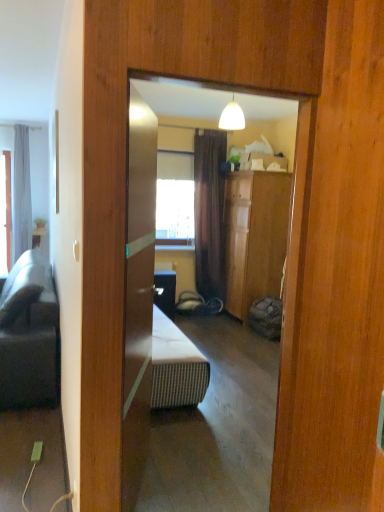
Describe the element at coordinates (21, 193) in the screenshot. I see `gray fabric curtain at left` at that location.

The image size is (384, 512). I want to click on dark gray fabric studio couch at left, so click(x=31, y=346).

How many degrees apart are the facing directions of gray fabric curtain at left and dark gray fabric studio couch at left?

88.5 degrees separate the facing orientations of gray fabric curtain at left and dark gray fabric studio couch at left.

From a real-world perspective, who is located higher, gray fabric curtain at left or dark gray fabric studio couch at left?

gray fabric curtain at left, from a real-world perspective.

Considering the sizes of gray fabric curtain at left and dark gray fabric studio couch at left in the image, is gray fabric curtain at left taller or shorter than dark gray fabric studio couch at left?

In the image, gray fabric curtain at left appears to be taller than dark gray fabric studio couch at left.

Is the position of gray fabric curtain at left more distant than that of dark gray fabric studio couch at left?

That is True.

From the image's perspective, which object appears higher, dark gray fabric studio couch at left or gray fabric curtain at left?

gray fabric curtain at left is shown above in the image.

Can you confirm if dark gray fabric studio couch at left is taller than gray fabric curtain at left?

Incorrect, the height of dark gray fabric studio couch at left is not larger of that of gray fabric curtain at left.

You are a GUI agent. You are given a task and a screenshot of the screen. Output one action in this format:
    pyautogui.click(x=<x>, y=<y>)
    Task: Click on the studio couch that is under the gray fabric curtain at left (from a real-world perspective)
    Image resolution: width=384 pixels, height=512 pixels.
    Given the screenshot: What is the action you would take?
    pyautogui.click(x=31, y=346)

Which object is positioned more to the left, dark gray fabric studio couch at left or gray fabric curtain at left?

gray fabric curtain at left.

Is there a large distance between gray fabric curtain at left and matte white table at left?

No.

Which object is wider, gray fabric curtain at left or matte white table at left?

gray fabric curtain at left.

From the image's perspective, would you say gray fabric curtain at left is shown under matte white table at left?

No, from the image's perspective, gray fabric curtain at left is not beneath matte white table at left.

Which is behind, gray fabric curtain at left or matte white table at left?

matte white table at left is further away from the camera.

Can we say dark gray fabric studio couch at left lies outside matte white table at left?

Indeed, dark gray fabric studio couch at left is completely outside matte white table at left.

Considering the relative positions of dark gray fabric studio couch at left and matte white table at left in the image provided, is dark gray fabric studio couch at left to the left of matte white table at left from the viewer's perspective?

No, dark gray fabric studio couch at left is not to the left of matte white table at left.

Is point (6, 389) closer or farther from the camera than point (43, 227)?

Point (6, 389) is closer to the camera than point (43, 227).

Is the depth of matte white table at left greater than that of dark gray fabric studio couch at left?

Answer: Yes, matte white table at left is further from the camera.

This screenshot has width=384, height=512. Identify the location of table above the dark gray fabric studio couch at left (from the image's perspective). (38, 236).

From the image's perspective, is matte white table at left on dark gray fabric studio couch at left?

Yes, from the image's perspective, matte white table at left is on top of dark gray fabric studio couch at left.

Based on their sizes in the image, would you say matte white table at left is bigger or smaller than dark gray fabric studio couch at left?

Considering their sizes, matte white table at left takes up less space than dark gray fabric studio couch at left.

Which is closer to the camera, (40, 244) or (19, 130)?

Point (40, 244) is positioned closer to the camera compared to point (19, 130).

Which object is more forward, matte white table at left or gray fabric curtain at left?

gray fabric curtain at left is closer to the camera.

Locate an element on the screen. table below the gray fabric curtain at left (from the image's perspective) is located at coordinates (38, 236).

What's the angular difference between matte white table at left and gray fabric curtain at left's facing directions?

They differ by 0.000341 degrees in their facing directions.

This screenshot has width=384, height=512. Identify the location of curtain located above the dark gray fabric studio couch at left (from the image's perspective). (21, 193).

At what (x,y) coordinates should I click in order to perform the action: click on curtain above the dark gray fabric studio couch at left (from a real-world perspective). Please return your answer as a coordinate pair (x, y). Looking at the image, I should click on (21, 193).

From the image, which object appears to be farther from matte white table at left, dark gray fabric studio couch at left or gray fabric curtain at left?

dark gray fabric studio couch at left lies further to matte white table at left than the other object.

Estimate the real-world distances between objects in this image. Which object is closer to dark gray fabric studio couch at left, gray fabric curtain at left or matte white table at left?

Based on the image, gray fabric curtain at left appears to be nearer to dark gray fabric studio couch at left.

Considering their positions, is matte white table at left positioned further to gray fabric curtain at left than dark gray fabric studio couch at left?

dark gray fabric studio couch at left lies further to gray fabric curtain at left than the other object.

From the image, which object appears to be nearer to matte white table at left, gray fabric curtain at left or dark gray fabric studio couch at left?

Based on the image, gray fabric curtain at left appears to be nearer to matte white table at left.

Considering their positions, is matte white table at left positioned closer to dark gray fabric studio couch at left than gray fabric curtain at left?

The object closer to dark gray fabric studio couch at left is gray fabric curtain at left.

In the scene shown: Which object lies further to the anchor point gray fabric curtain at left, dark gray fabric studio couch at left or matte white table at left?

dark gray fabric studio couch at left is further to gray fabric curtain at left.

Find the location of `curtain between dark gray fabric studio couch at left and matte white table at left in the front-back direction`. curtain between dark gray fabric studio couch at left and matte white table at left in the front-back direction is located at coordinates (21, 193).